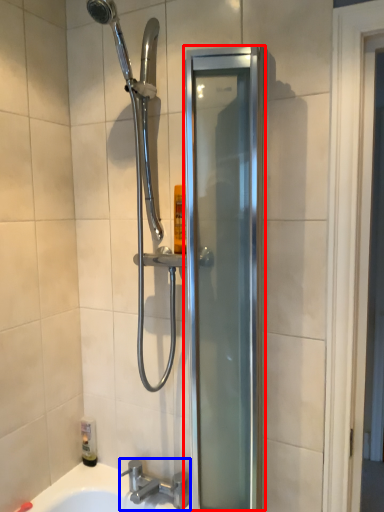
Question: Which point is closer to the camera, screen door (highlighted by a red box) or tap (highlighted by a blue box)?

Choices:
 (A) screen door
 (B) tap

Answer: (A)